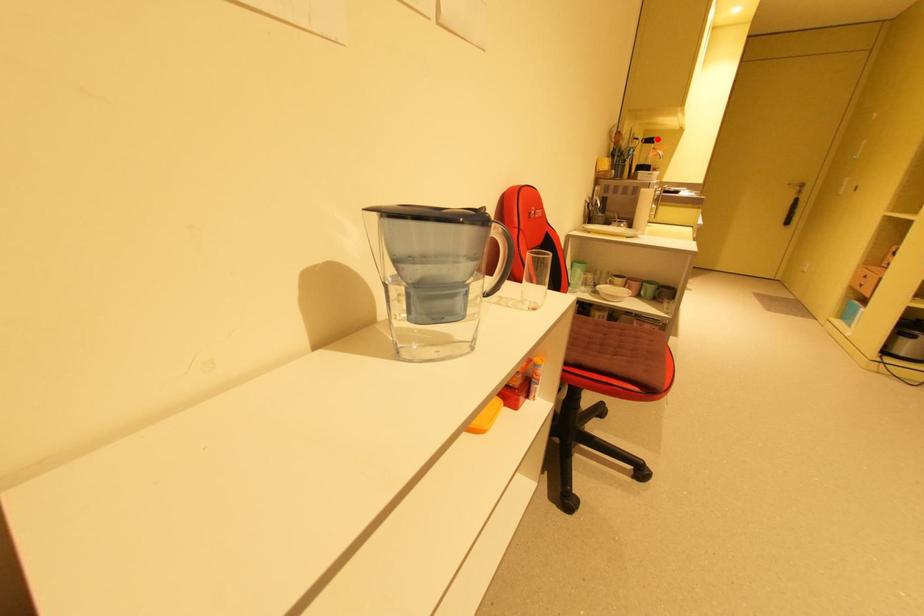
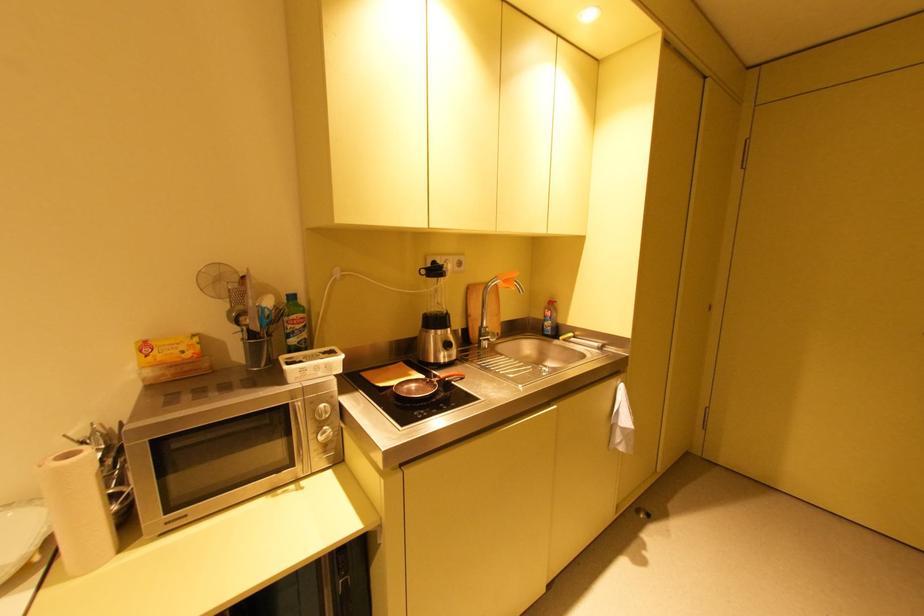
The point at the highlighted location is marked in the first image. Where is the corresponding point in the second image?

(444, 267)